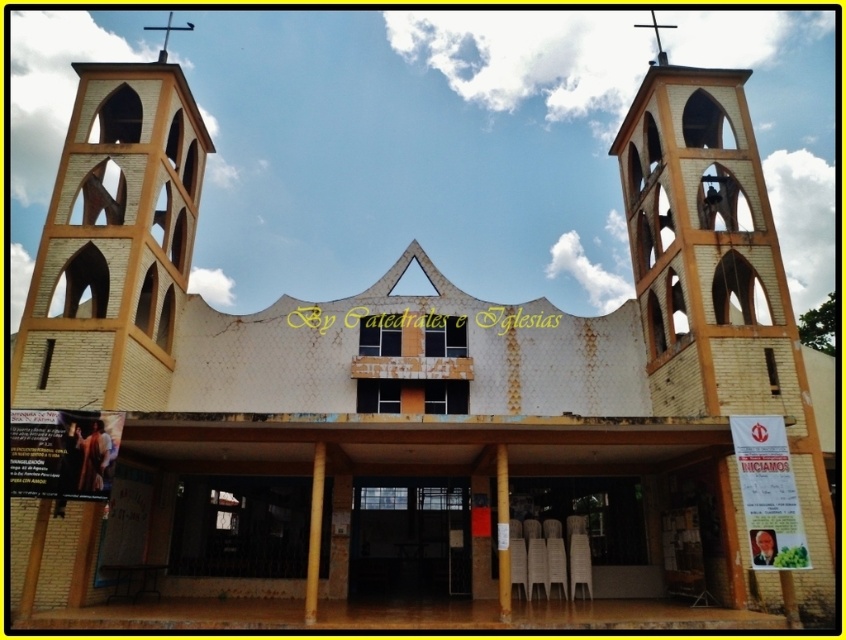
Question: Is yellow brick bell tower at upper center positioned in front of smooth gold cross at upper center?

Choices:
 (A) yes
 (B) no

Answer: (A)

Question: Is yellow brick bell tower at upper center smaller than smooth gold cross at upper center?

Choices:
 (A) no
 (B) yes

Answer: (A)

Question: Is yellow brick bell tower at upper center thinner than smooth gold cross at upper center?

Choices:
 (A) no
 (B) yes

Answer: (A)

Question: Which object appears closest to the camera in this image?

Choices:
 (A) yellow brick bell tower at upper center
 (B) smooth gold cross at upper center

Answer: (A)

Question: Among these points, which one is nearest to the camera?

Choices:
 (A) (144, 72)
 (B) (657, 35)

Answer: (A)